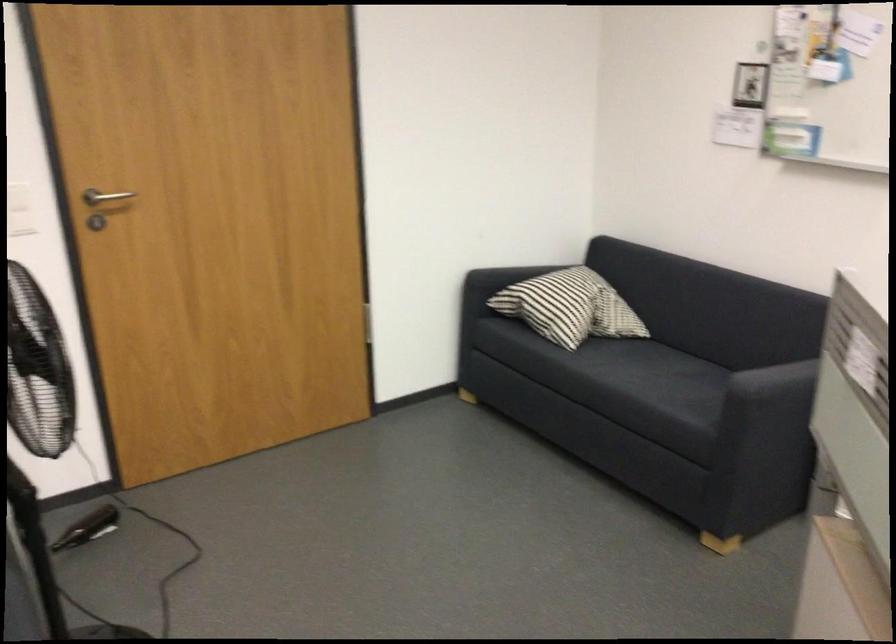
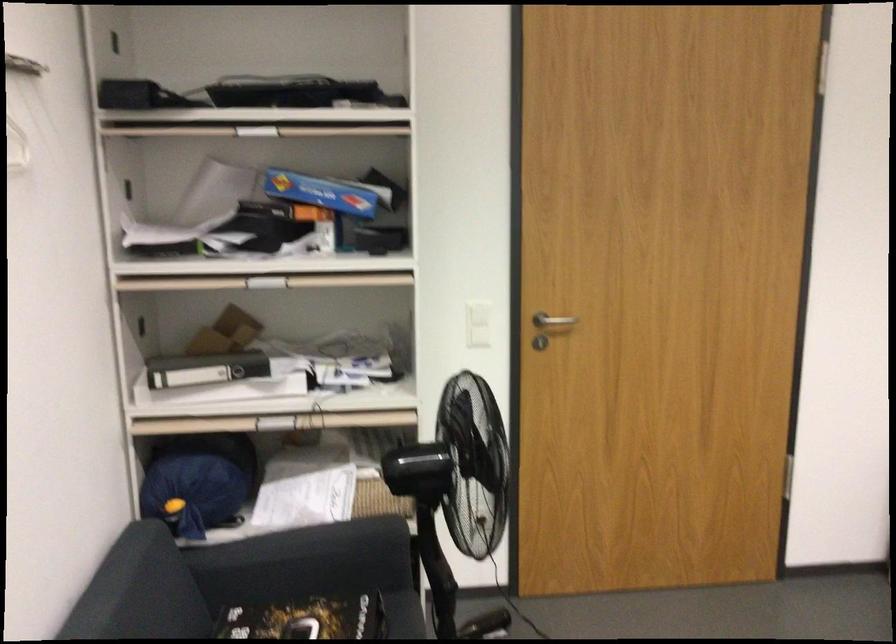
Question: The camera is either moving clockwise (left) or counter-clockwise (right) around the object. The first image is from the beginning of the video and the second image is from the end. Is the camera moving left or right when shooting the video?

Choices:
 (A) Left
 (B) Right

Answer: (B)